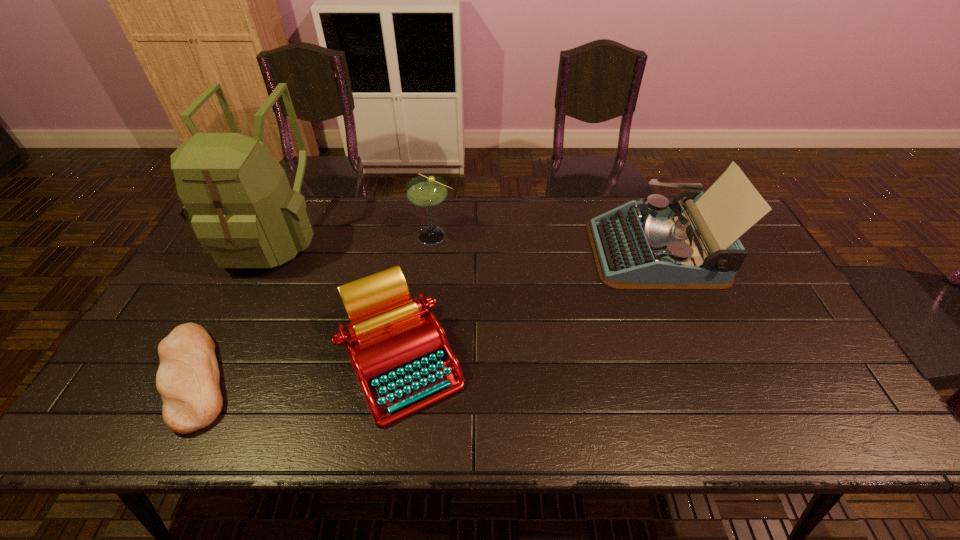
This screenshot has height=540, width=960. I want to click on object positioned at the right edge, so click(655, 245).

Locate an element on the screen. This screenshot has width=960, height=540. object that is positioned at the far left corner is located at coordinates (237, 199).

Locate an element on the screen. The image size is (960, 540). object present at the near left corner is located at coordinates (188, 377).

Locate an element on the screen. The height and width of the screenshot is (540, 960). object at the far right corner is located at coordinates (655, 245).

I want to click on free space at the far edge, so click(x=557, y=214).

Locate an element on the screen. This screenshot has height=540, width=960. vacant space at the near edge of the desktop is located at coordinates (433, 434).

Where is `vacant space at the left edge`? The height and width of the screenshot is (540, 960). vacant space at the left edge is located at coordinates (204, 319).

At what (x,y) coordinates should I click in order to perform the action: click on vacant space at the right edge of the desktop. Please return your answer as a coordinate pair (x, y). The height and width of the screenshot is (540, 960). Looking at the image, I should click on (783, 399).

Where is `free space between the shorter typewriter and the taller typewriter`? free space between the shorter typewriter and the taller typewriter is located at coordinates (529, 306).

The image size is (960, 540). I want to click on free spot between the second shortest object and the backpack, so click(338, 299).